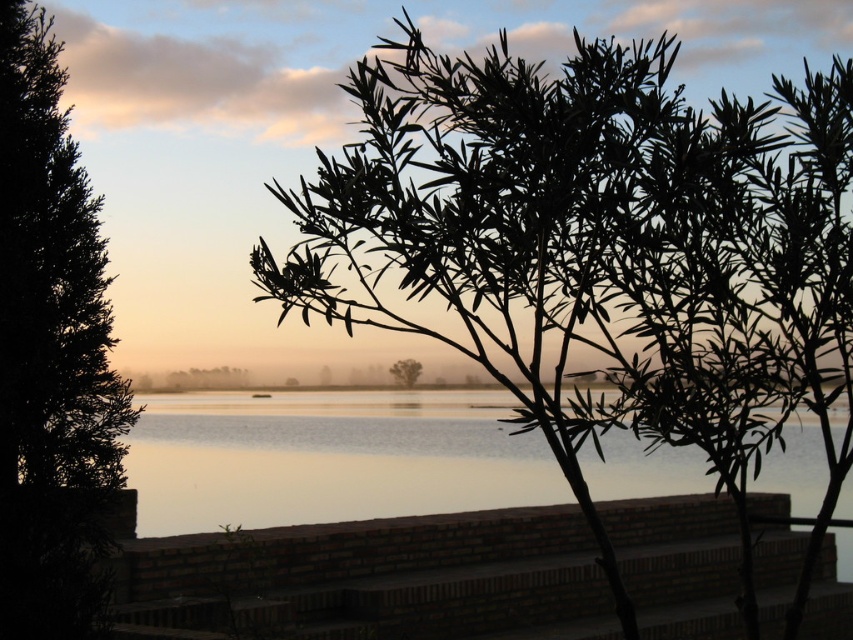
In the scene shown: Does green leafy tree at left have a greater height compared to silvery reflective water at center?

Correct, green leafy tree at left is much taller as silvery reflective water at center.

Identify the location of green leafy tree at left. This screenshot has height=640, width=853. (51, 355).

Identify the location of green leafy tree at left. (51, 355).

Is point (695, 196) farther from camera compared to point (413, 374)?

No, it is not.

Which is behind, point (782, 276) or point (405, 371)?

Positioned behind is point (405, 371).

The image size is (853, 640). Identify the location of silhouette leafy branch at upper center. (583, 250).

Does silhouette leafy branch at upper center appear on the left side of silvery reflective water at center?

Incorrect, silhouette leafy branch at upper center is not on the left side of silvery reflective water at center.

Does silhouette leafy branch at upper center have a smaller size compared to silvery reflective water at center?

Incorrect, silhouette leafy branch at upper center is not smaller in size than silvery reflective water at center.

Between point (676, 182) and point (312, 477), which one is positioned behind?

Point (312, 477)

The image size is (853, 640). In order to click on silhouette leafy branch at upper center in this screenshot , I will do `click(583, 250)`.